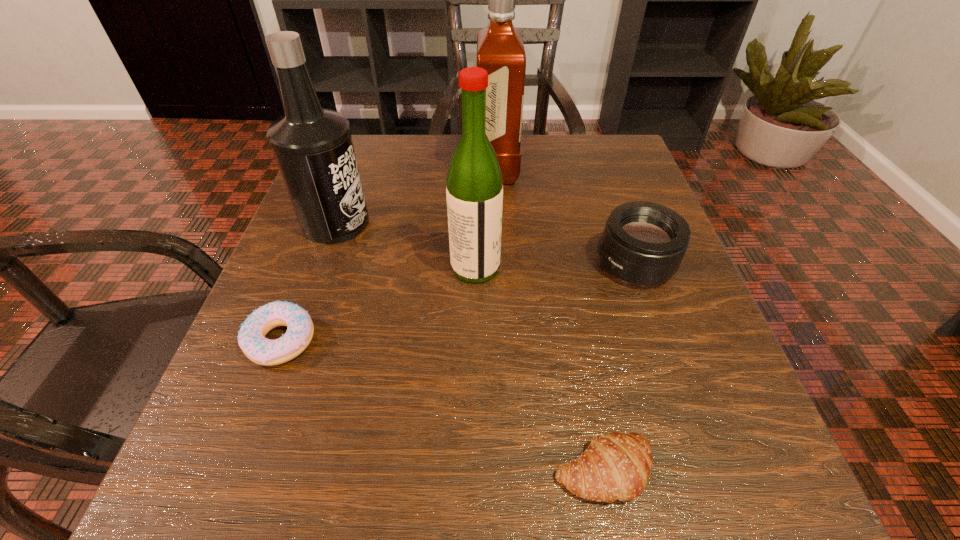
This screenshot has height=540, width=960. I want to click on the farthest liquor, so click(500, 50).

Where is `the leftmost liquor`? This screenshot has height=540, width=960. the leftmost liquor is located at coordinates (313, 146).

Where is `the nearest liquor`? This screenshot has width=960, height=540. the nearest liquor is located at coordinates (474, 191).

This screenshot has width=960, height=540. I want to click on the fourth tallest object, so click(643, 243).

Identify the location of crescent roll. (616, 466).

Find the location of `doughnut`. doughnut is located at coordinates (251, 338).

In order to click on vacant space situated on the front label of the farthest liquor in this screenshot , I will do `click(440, 170)`.

Find the location of a particular element. This screenshot has width=960, height=540. free space located on the front label of the farthest liquor is located at coordinates (440, 170).

The height and width of the screenshot is (540, 960). I want to click on vacant space situated 0.160m on the front label of the farthest liquor, so click(x=404, y=170).

Find the location of a particular element. free point located on the front label of the second nearest liquor is located at coordinates (525, 223).